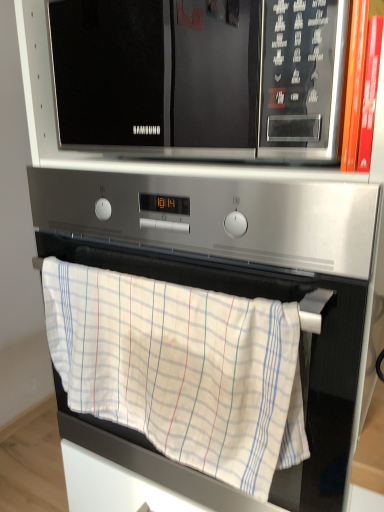
Question: From their relative heights in the image, would you say black glossy microwave at upper center is taller or shorter than satin silver oven at center?

Choices:
 (A) short
 (B) tall

Answer: (A)

Question: In the image, is black glossy microwave at upper center positioned in front of or behind satin silver oven at center?

Choices:
 (A) behind
 (B) front

Answer: (B)

Question: Looking at their shapes, would you say black glossy microwave at upper center is wider or thinner than satin silver oven at center?

Choices:
 (A) wide
 (B) thin

Answer: (B)

Question: Is satin silver oven at center wider or thinner than black glossy microwave at upper center?

Choices:
 (A) wide
 (B) thin

Answer: (A)

Question: From the image's perspective, is satin silver oven at center above or below black glossy microwave at upper center?

Choices:
 (A) above
 (B) below

Answer: (B)

Question: From a real-world perspective, relative to black glossy microwave at upper center, is satin silver oven at center vertically above or below?

Choices:
 (A) below
 (B) above

Answer: (A)

Question: Is point (114, 438) closer or farther from the camera than point (167, 66)?

Choices:
 (A) closer
 (B) farther

Answer: (B)